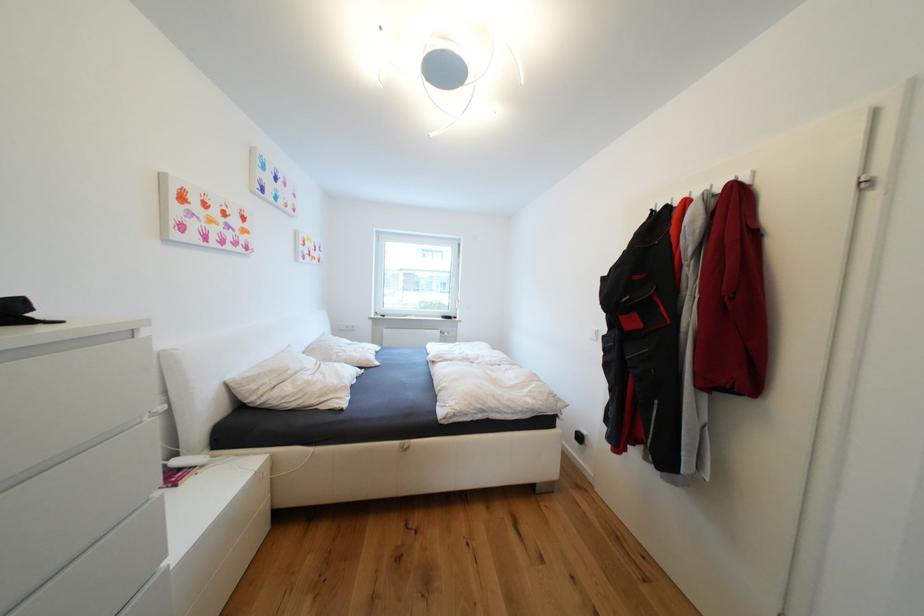
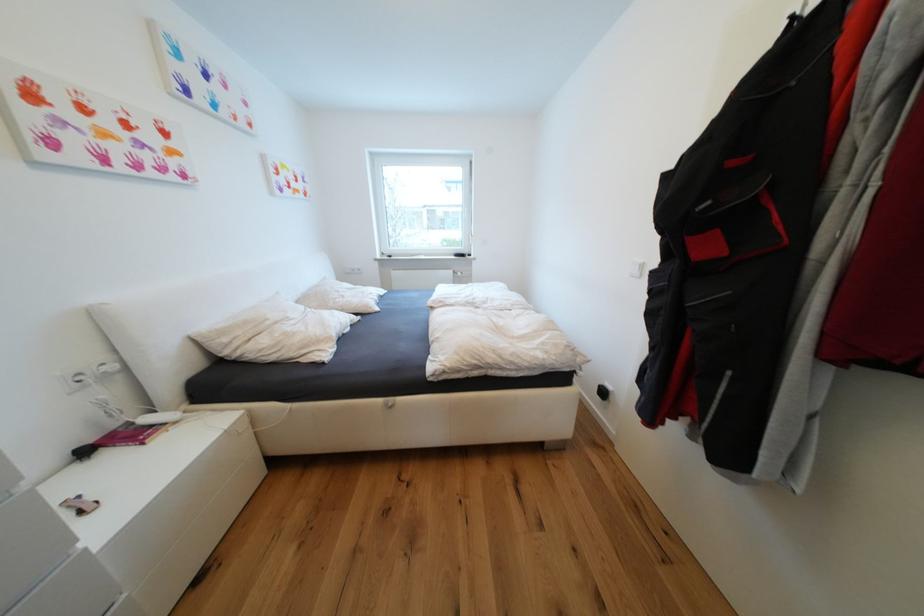
Question: How did the camera likely rotate?

Choices:
 (A) Left
 (B) Right
 (C) Up
 (D) Down

Answer: (D)